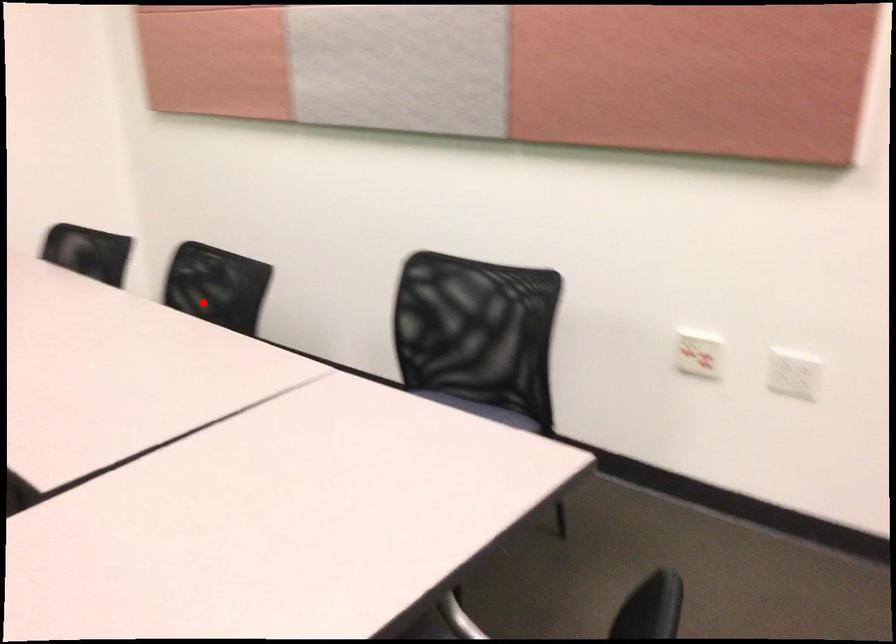
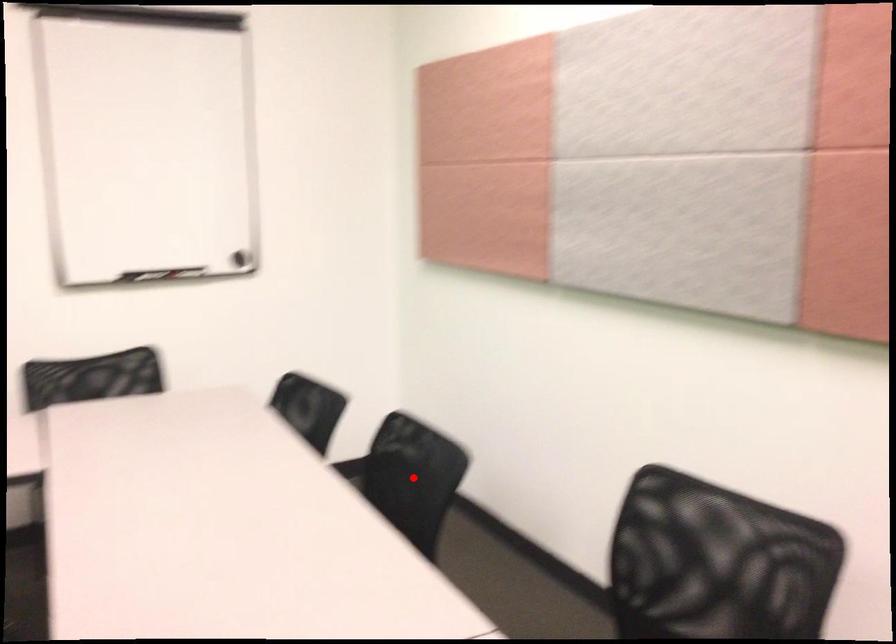
From the picture: I am providing you with two images of the same scene from different viewpoints. A red point is marked on the first image and another point is marked on the second image. Is the marked point in image1 the same physical position as the marked point in image2?

Yes